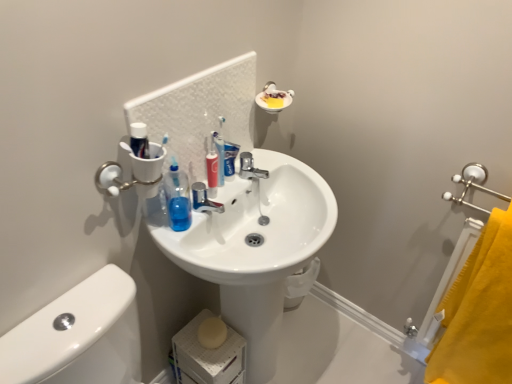
Question: Based on their sizes in the image, would you say white glossy toothpaste at center is bigger or smaller than translucent plastic toothbrush at center?

Choices:
 (A) big
 (B) small

Answer: (A)

Question: Looking at their shapes, would you say white glossy toothpaste at center is wider or thinner than translucent plastic toothbrush at center?

Choices:
 (A) wide
 (B) thin

Answer: (B)

Question: Which of these objects is positioned farthest from the yellow fabric towel at right?

Choices:
 (A) white glossy toothpaste at center
 (B) white textured mirror at upper center
 (C) white glossy sink at center
 (D) translucent plastic toothbrush at center

Answer: (D)

Question: Which of these objects is positioned farthest from the white textured mirror at upper center?

Choices:
 (A) yellow fabric towel at right
 (B) translucent plastic toothbrush at center
 (C) white glossy toothpaste at center
 (D) white glossy sink at center

Answer: (A)